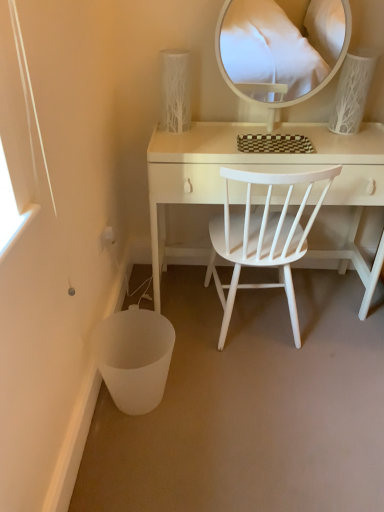
Where is `free spot in front of white textured vase at upper center, which ranks as the 1th table lamp in left-to-right order`? The image size is (384, 512). free spot in front of white textured vase at upper center, which ranks as the 1th table lamp in left-to-right order is located at coordinates (187, 140).